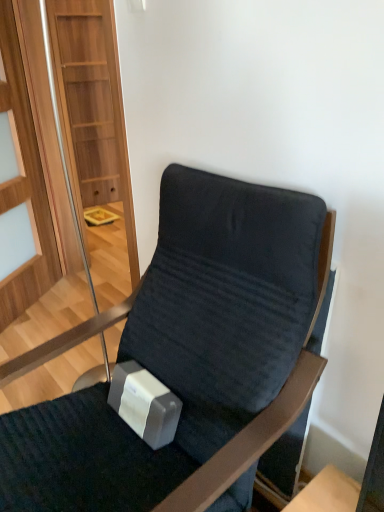
Question: Considering the relative sizes of velvet dark blue chair at center and transparent glass door at left in the image provided, is velvet dark blue chair at center shorter than transparent glass door at left?

Choices:
 (A) yes
 (B) no

Answer: (A)

Question: From a real-world perspective, is velvet dark blue chair at center below transparent glass door at left?

Choices:
 (A) yes
 (B) no

Answer: (A)

Question: Is velvet dark blue chair at center positioned far away from transparent glass door at left?

Choices:
 (A) yes
 (B) no

Answer: (A)

Question: Is velvet dark blue chair at center beside transparent glass door at left?

Choices:
 (A) yes
 (B) no

Answer: (B)

Question: From the image's perspective, does velvet dark blue chair at center appear higher than transparent glass door at left?

Choices:
 (A) yes
 (B) no

Answer: (B)

Question: Considering the relative positions of velvet dark blue chair at center and transparent glass door at left in the image provided, is velvet dark blue chair at center to the right of transparent glass door at left from the viewer's perspective?

Choices:
 (A) yes
 (B) no

Answer: (A)

Question: Can we say transparent glass door at left lies outside velvet dark blue chair at center?

Choices:
 (A) yes
 (B) no

Answer: (A)

Question: From a real-world perspective, is transparent glass door at left positioned under velvet dark blue chair at center based on gravity?

Choices:
 (A) yes
 (B) no

Answer: (B)

Question: Is transparent glass door at left in contact with velvet dark blue chair at center?

Choices:
 (A) yes
 (B) no

Answer: (B)

Question: Does transparent glass door at left lie in front of velvet dark blue chair at center?

Choices:
 (A) no
 (B) yes

Answer: (A)

Question: Would you consider transparent glass door at left to be distant from velvet dark blue chair at center?

Choices:
 (A) no
 (B) yes

Answer: (B)

Question: From a real-world perspective, is transparent glass door at left over velvet dark blue chair at center?

Choices:
 (A) no
 (B) yes

Answer: (B)

Question: From a real-world perspective, is velvet dark blue chair at center positioned above or below transparent glass door at left?

Choices:
 (A) below
 (B) above

Answer: (A)